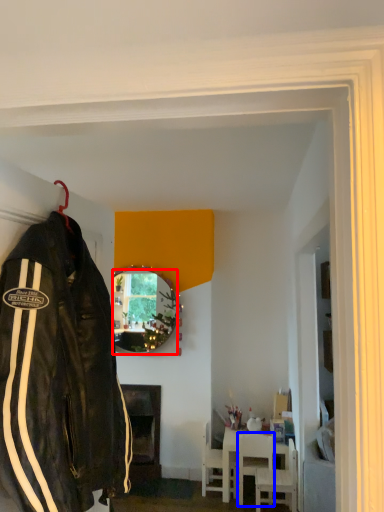
Question: Among these objects, which one is farthest to the camera, mirror (highlighted by a red box) or chair (highlighted by a blue box)?

Choices:
 (A) mirror
 (B) chair

Answer: (A)